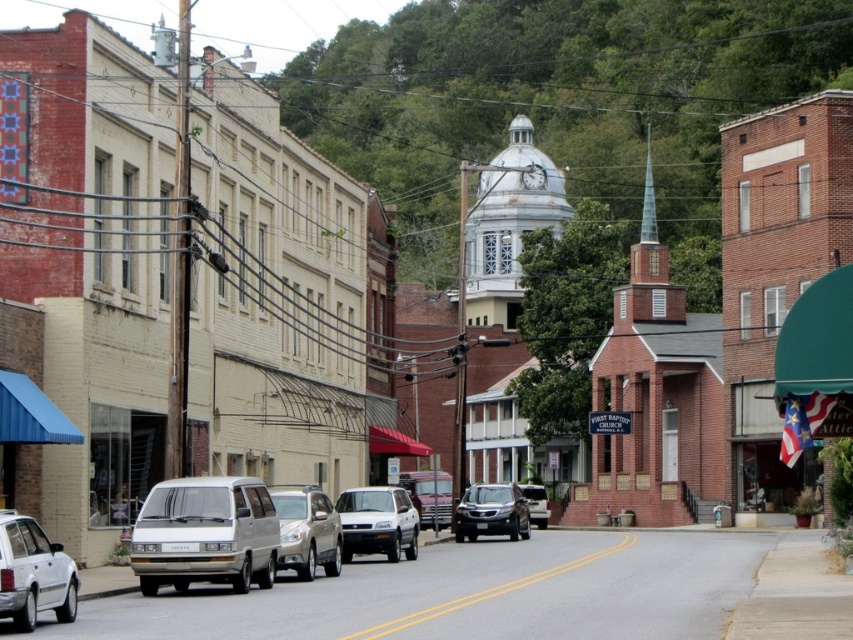
Who is higher up, white matte van at center or metallic silver suv at center?

white matte van at center is higher up.

Is white matte van at center taller than metallic silver suv at center?

Indeed, white matte van at center has a greater height compared to metallic silver suv at center.

Where is `white matte van at center`? white matte van at center is located at coordinates pyautogui.click(x=206, y=534).

Does white matte suv at center have a greater height compared to satin black suv at center?

No.

Who is more forward, (370, 524) or (502, 492)?

Positioned in front is point (370, 524).

Is point (416, 518) positioned in front of point (480, 492)?

Yes, point (416, 518) is in front of point (480, 492).

This screenshot has width=853, height=640. I want to click on white matte suv at center, so click(376, 522).

Which of these two, white matte van at lower left or metallic silver truck at center, stands shorter?

With less height is white matte van at lower left.

Which is behind, point (73, 608) or point (437, 472)?

Point (437, 472)

At what (x,y) coordinates should I click in order to perform the action: click on white matte van at lower left. Please return your answer as a coordinate pair (x, y). Looking at the image, I should click on (33, 573).